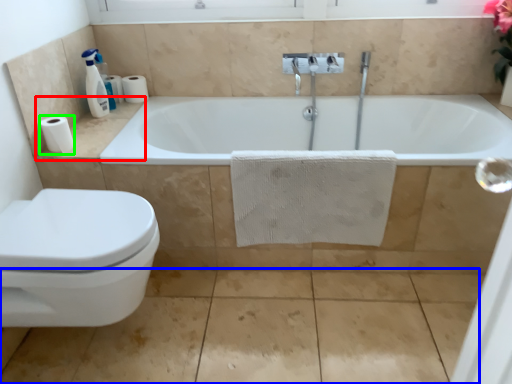
Question: Considering the real-world distances, which object is closest to counter top (highlighted by a red box)? concrete (highlighted by a blue box) or toilet paper (highlighted by a green box).

Choices:
 (A) concrete
 (B) toilet paper

Answer: (B)